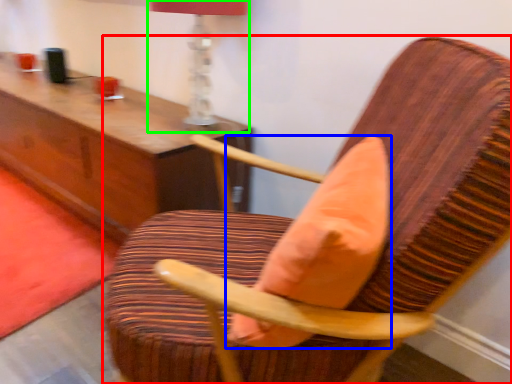
Question: Which object is positioned farthest from chair (highlighted by a red box)? Select from throw pillow (highlighted by a blue box) and table lamp (highlighted by a green box).

Choices:
 (A) throw pillow
 (B) table lamp

Answer: (B)